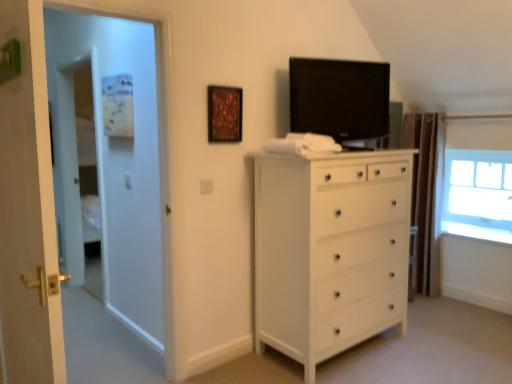
The width and height of the screenshot is (512, 384). Find the location of `free space in front of brown textured curtain at right`. free space in front of brown textured curtain at right is located at coordinates (428, 299).